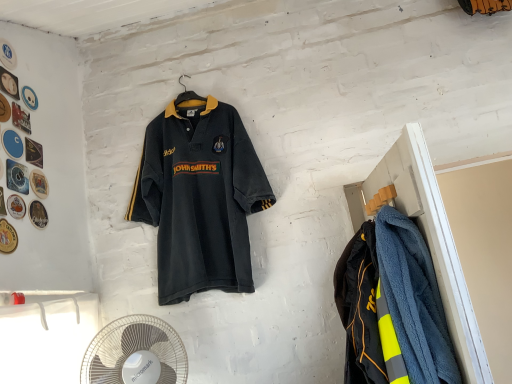
Question: Is neon yellow reflective jacket at right taller or shorter than dark gray jersey at center?

Choices:
 (A) short
 (B) tall

Answer: (A)

Question: Would you say neon yellow reflective jacket at right is inside or outside dark gray jersey at center?

Choices:
 (A) outside
 (B) inside

Answer: (A)

Question: Estimate the real-world distances between objects in this image. Which object is farther from the blue fuzzy coat at right?

Choices:
 (A) dark gray jersey at center
 (B) white plastic fan at lower left
 (C) neon yellow reflective jacket at right

Answer: (B)

Question: Estimate the real-world distances between objects in this image. Which object is closer to the blue fuzzy coat at right?

Choices:
 (A) white plastic fan at lower left
 (B) dark gray jersey at center
 (C) neon yellow reflective jacket at right

Answer: (C)